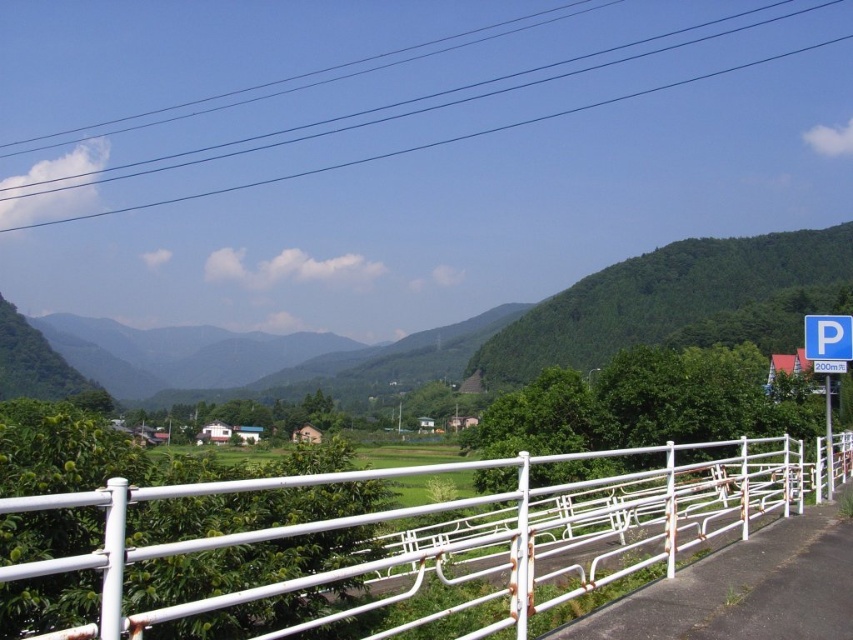
You are standing on a bridge and see the white metal fence at center and the green leafy mountain at center. Which object is nearer to you?

The white metal fence at center is closer to the viewer than the green leafy mountain at center.

You are standing at the viewpoint and want to locate the white metal fence at center. According to the coordinates provided, where exactly is it positioned in the image?

The white metal fence at center is positioned at coordinates point (457, 532).

You are standing on a bridge and see the white metal fence at center and the blue plastic parking sign at right. Which object is nearer to you?

The white metal fence at center is closer to the viewer than the blue plastic parking sign at right.